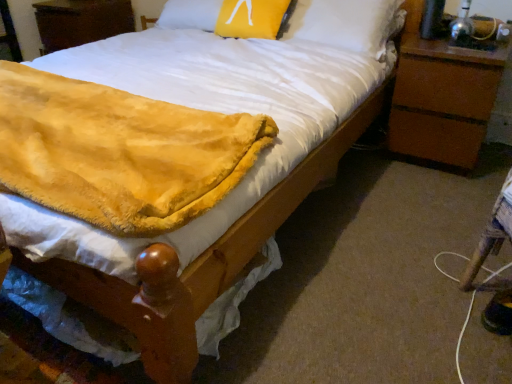
Question: From a real-world perspective, is fuzzy yellow blanket at lower left positioned above or below brown wood nightstand at right, acting as the 1th nightstand starting from the front?

Choices:
 (A) below
 (B) above

Answer: (B)

Question: Choose the correct answer: Is fuzzy yellow blanket at lower left inside brown wood nightstand at right, which is counted as the second nightstand, starting from the left, or outside it?

Choices:
 (A) inside
 (B) outside

Answer: (B)

Question: Which object is positioned closest to the yellow fuzzy pillow at upper center?

Choices:
 (A) brown wood nightstand at right, placed as the second nightstand when sorted from back to front
 (B) fuzzy yellow blanket at lower left
 (C) wooden nightstand at upper left, positioned as the first nightstand in top-to-bottom order

Answer: (A)

Question: Estimate the real-world distances between objects in this image. Which object is farther from the brown wood nightstand at right, marked as the 1th nightstand in a bottom-to-top arrangement?

Choices:
 (A) fuzzy yellow blanket at lower left
 (B) yellow fuzzy pillow at upper center
 (C) wooden nightstand at upper left, positioned as the first nightstand in top-to-bottom order

Answer: (C)